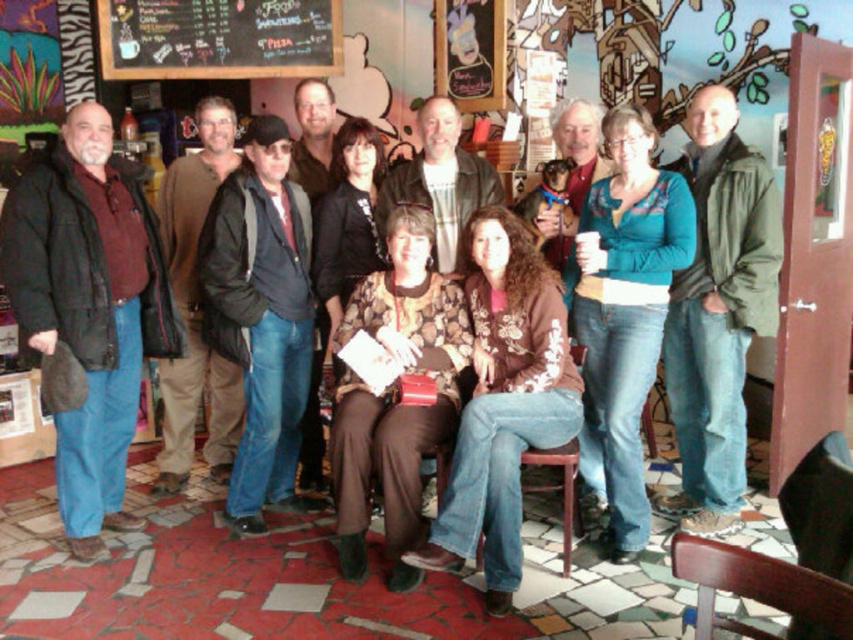
Looking at this image, is black chalkboard menu at upper center positioned before brown leather jacket at center?

That is False.

Which is more to the right, black chalkboard menu at upper center or brown leather jacket at center?

From the viewer's perspective, brown leather jacket at center appears more on the right side.

Where is `black chalkboard menu at upper center`? The width and height of the screenshot is (853, 640). black chalkboard menu at upper center is located at coordinates (218, 38).

Can you confirm if floral-patterned sweater at center is positioned to the right of black chalkboard menu at upper center?

Correct, you'll find floral-patterned sweater at center to the right of black chalkboard menu at upper center.

Does point (577, 404) come behind point (200, 61)?

No, (577, 404) is in front of (200, 61).

Where is `floral-patterned sweater at center`? The image size is (853, 640). floral-patterned sweater at center is located at coordinates (503, 403).

Does green matte jacket at center appear under brown leather jacket at center?

Yes.

Based on the photo, does green matte jacket at center appear over brown leather jacket at center?

No, green matte jacket at center is not above brown leather jacket at center.

Consider the image. Who is more distant from viewer, (x=724, y=515) or (x=445, y=148)?

The point (x=445, y=148) is more distant.

In order to click on green matte jacket at center in this screenshot , I will do `click(718, 312)`.